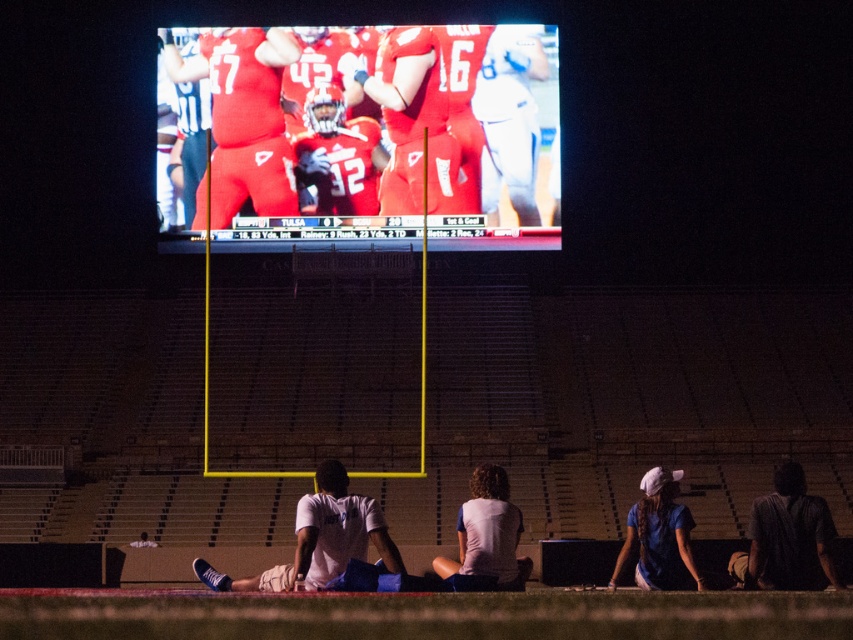
Locate an element on the screen. This screenshot has height=640, width=853. dark brown textured shirt at lower right is located at coordinates (787, 538).

The width and height of the screenshot is (853, 640). What are the coordinates of `dark brown textured shirt at lower right` in the screenshot? It's located at (787, 538).

The image size is (853, 640). I want to click on dark brown textured shirt at lower right, so click(x=787, y=538).

Which is behind, point (457, 566) or point (646, 548)?

Positioned behind is point (646, 548).

Which is below, white cotton shirt at center or blue cotton shirt at lower right?

Positioned lower is blue cotton shirt at lower right.

From the picture: Measure the distance between point (490, 477) and camera.

Point (490, 477) and camera are 56.30 feet apart from each other.

The height and width of the screenshot is (640, 853). In order to click on white cotton shirt at center in this screenshot , I will do `click(488, 532)`.

Between point (469, 163) and point (296, 538), which one is positioned behind?

Point (469, 163)

The image size is (853, 640). Find the location of `matte red uniform at center`. matte red uniform at center is located at coordinates (467, 115).

The image size is (853, 640). Describe the element at coordinates (467, 115) in the screenshot. I see `matte red uniform at center` at that location.

You are a GUI agent. You are given a task and a screenshot of the screen. Output one action in this format:
    pyautogui.click(x=<x>, y=<y>)
    Task: Click on the matte red uniform at center
    This screenshot has height=640, width=853.
    Given the screenshot: What is the action you would take?
    pyautogui.click(x=467, y=115)